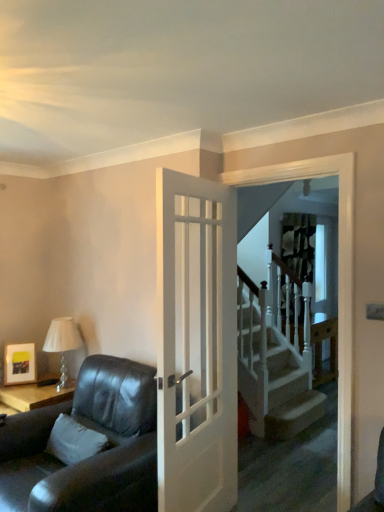
Question: Considering the positions of matte black picture frame at upper left and white glass table lamp at left in the image, is matte black picture frame at upper left taller or shorter than white glass table lamp at left?

Choices:
 (A) tall
 (B) short

Answer: (B)

Question: Is matte black picture frame at upper left wider or thinner than white glass table lamp at left?

Choices:
 (A) thin
 (B) wide

Answer: (A)

Question: Estimate the real-world distances between objects in this image. Which object is closer to the leather couch at left?

Choices:
 (A) matte black picture frame at upper left
 (B) white soft pillow at lower left
 (C) white glossy door at center
 (D) wooden at right
 (E) white glossy screen door at upper center

Answer: (B)

Question: Which object is positioned farthest from the patterned fabric curtain at upper center?

Choices:
 (A) wooden at right
 (B) white glossy door at center
 (C) white glossy screen door at upper center
 (D) white soft pillow at lower left
 (E) white glass table lamp at left

Answer: (D)